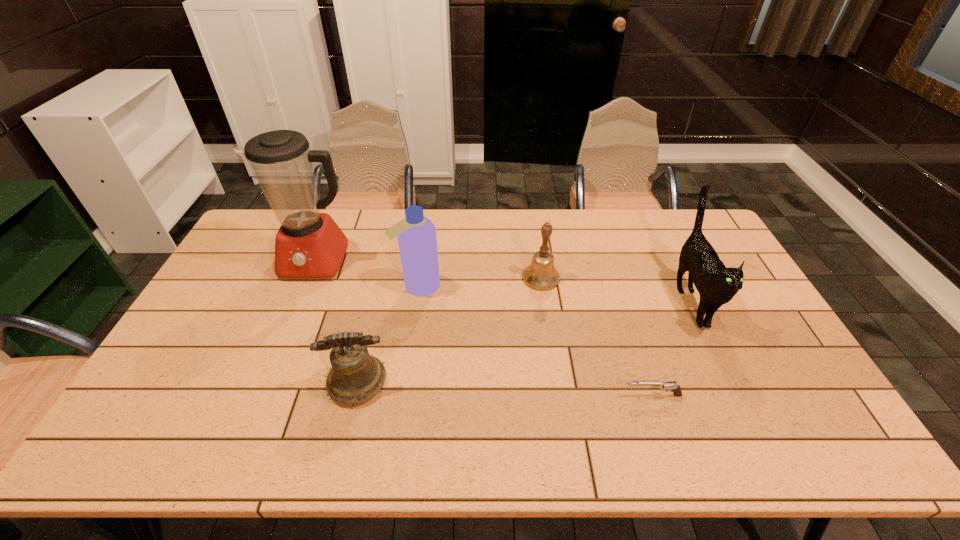
I want to click on vacant space located 0.320m on the front of the leftmost object near the controls, so click(x=273, y=364).

The width and height of the screenshot is (960, 540). What are the coordinates of `free space located 0.160m on the face of the cat` in the screenshot? It's located at (733, 391).

Where is `free space located on the back of the shampoo`? This screenshot has height=540, width=960. free space located on the back of the shampoo is located at coordinates (430, 210).

You are a GUI agent. You are given a task and a screenshot of the screen. Output one action in this format:
    pyautogui.click(x=<x>, y=<y>)
    Task: Click on the vacant space located on the back of the fourth tallest object
    The height and width of the screenshot is (540, 960).
    Given the screenshot: What is the action you would take?
    pyautogui.click(x=532, y=213)

The image size is (960, 540). Identify the location of vacant space located on the back of the fifth tallest object. (373, 316).

This screenshot has width=960, height=540. I want to click on vacant region located 0.300m on the front-facing side of the shortest object, so click(x=506, y=395).

Identify the location of vacant space located on the front-facing side of the shortest object. Image resolution: width=960 pixels, height=540 pixels. (600, 395).

You are a GUI agent. You are given a task and a screenshot of the screen. Output one action in this format:
    pyautogui.click(x=<x>, y=<y>)
    Task: Click on the vacant space located on the front-facing side of the shortest object
    
    Given the screenshot: What is the action you would take?
    pyautogui.click(x=596, y=395)

At what (x,y) coordinates should I click in order to perform the action: click on object that is at the far edge. Please return your answer as a coordinate pair (x, y). Looking at the image, I should click on (309, 244).

At what (x,y) coordinates should I click in order to perform the action: click on object located at the left edge. Please return your answer as a coordinate pair (x, y). Image resolution: width=960 pixels, height=540 pixels. Looking at the image, I should click on (309, 244).